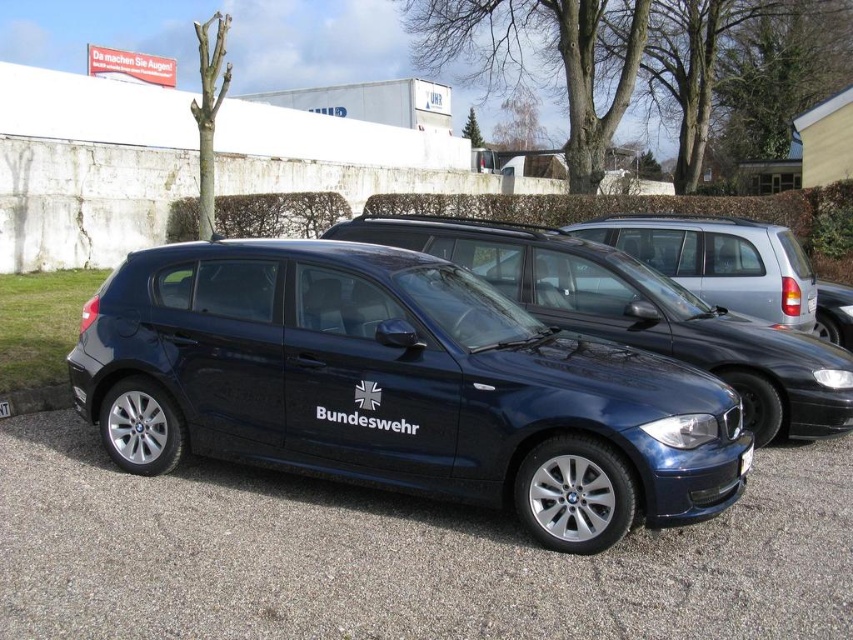
Question: Which object is the closest to the satin silver minivan at center?

Choices:
 (A) white plastic license plate at center
 (B) white plastic license plate at lower right
 (C) glossy blue car at center

Answer: (B)

Question: Among these objects, which one is nearest to the camera?

Choices:
 (A) white plastic license plate at center
 (B) white plastic license plate at lower right

Answer: (B)

Question: Which point appears closest to the camera in this image?

Choices:
 (A) (751, 444)
 (B) (682, 321)

Answer: (A)

Question: Does glossy blue car at center have a smaller size compared to satin silver minivan at center?

Choices:
 (A) yes
 (B) no

Answer: (A)

Question: Does satin black sedan at center appear on the right side of satin black car at center?

Choices:
 (A) no
 (B) yes

Answer: (A)

Question: Is satin black sedan at center thinner than white plastic license plate at center?

Choices:
 (A) no
 (B) yes

Answer: (A)